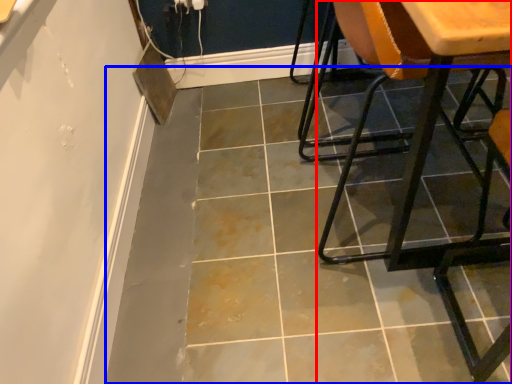
Question: Which point is further to the camera, chair (highlighted by a red box) or concrete (highlighted by a blue box)?

Choices:
 (A) chair
 (B) concrete

Answer: (B)